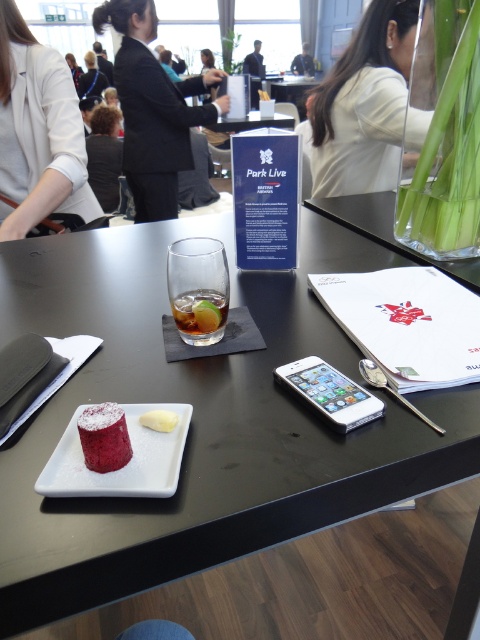
You are at a corporate event and need to grab the clear glass at center and the black fabric jacket at upper center from the table. Which item should you reach for first if you want to avoid knocking over anything?

You should reach for the clear glass at center first because it is below the black fabric jacket at upper center, meaning the jacket is higher up and less likely to be knocked over if you take the glass first.

You are planning to place a decorative item on the table. The white creamy cheese at center and the dark blue suit at center are already there. Which object should you place your new item next to if you want it to be taller than both?

You should place your new item next to the white creamy cheese at center because it is shorter than the dark blue suit at center, so the new item will be taller than both if placed there.